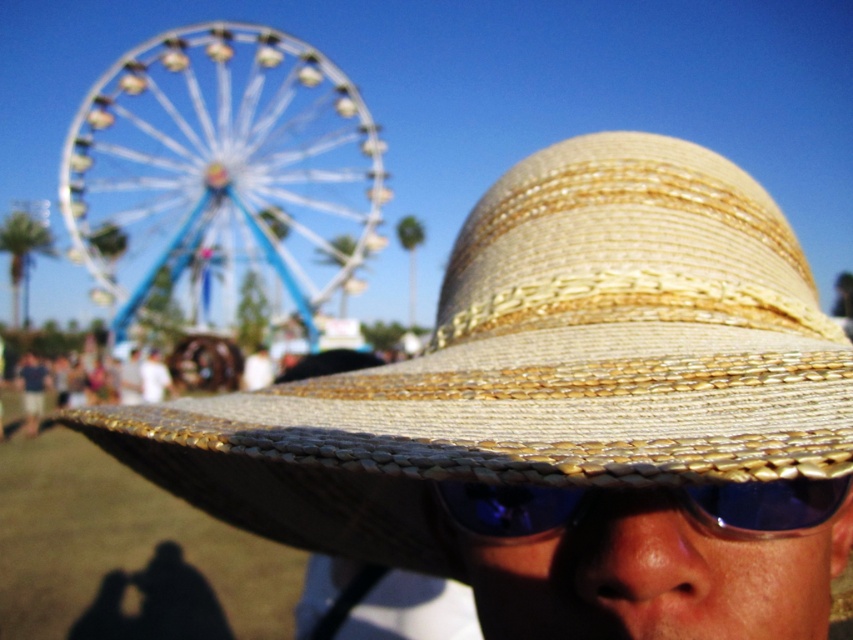
Who is positioned more to the right, metallic blue ferris wheel at upper left or blue reflective plastic goggles at center?

blue reflective plastic goggles at center

Is metallic blue ferris wheel at upper left to the right of blue reflective plastic goggles at center from the viewer's perspective?

Incorrect, metallic blue ferris wheel at upper left is not on the right side of blue reflective plastic goggles at center.

Does point (190, 170) come closer to viewer compared to point (558, 509)?

No, it is not.

This screenshot has height=640, width=853. I want to click on metallic blue ferris wheel at upper left, so click(222, 170).

Can you confirm if natural straw hat at center is positioned above metallic blue ferris wheel at upper left?

No, natural straw hat at center is not above metallic blue ferris wheel at upper left.

Does natural straw hat at center lie behind metallic blue ferris wheel at upper left?

No, natural straw hat at center is closer to the viewer.

Is point (146, 449) more distant than point (86, 115)?

No, it is in front of (86, 115).

Locate an element on the screen. The image size is (853, 640). natural straw hat at center is located at coordinates 538,365.

Does natural straw hat at center have a greater width compared to blue reflective plastic goggles at center?

Yes.

Locate an element on the screen. This screenshot has height=640, width=853. natural straw hat at center is located at coordinates pyautogui.click(x=538, y=365).

Identify the location of natural straw hat at center. The height and width of the screenshot is (640, 853). (538, 365).

Identify the location of natural straw hat at center. (538, 365).